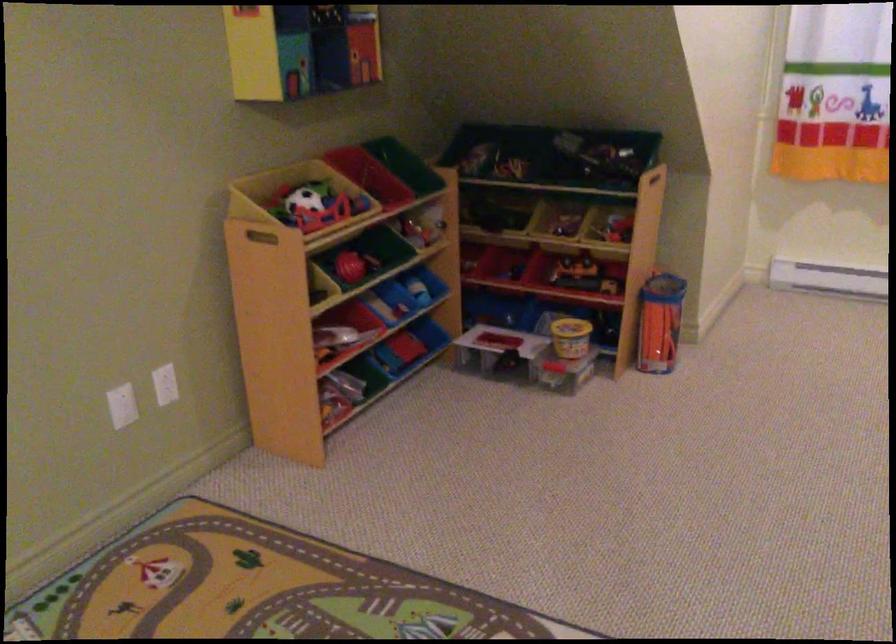
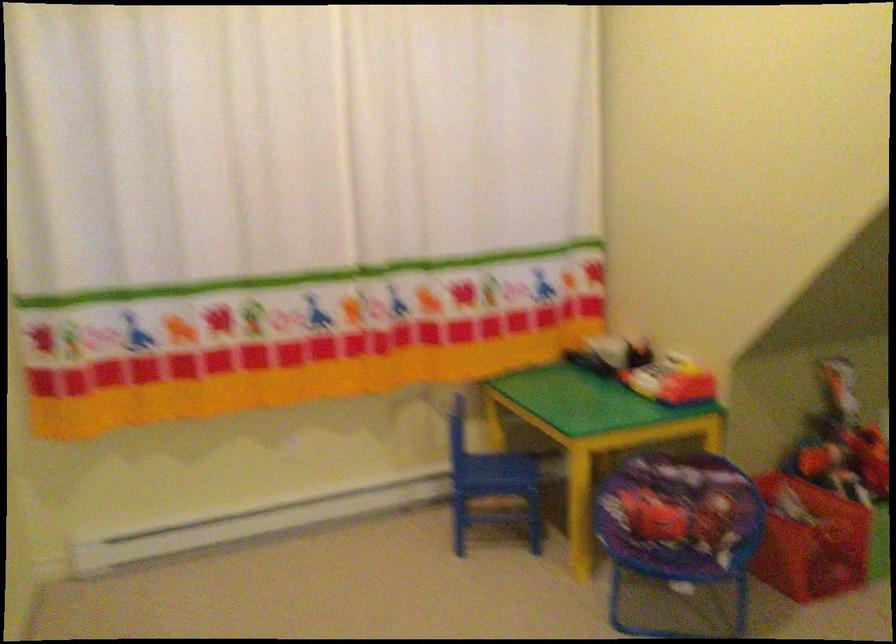
Question: How did the camera likely rotate?

Choices:
 (A) Left
 (B) Right
 (C) Up
 (D) Down

Answer: (B)